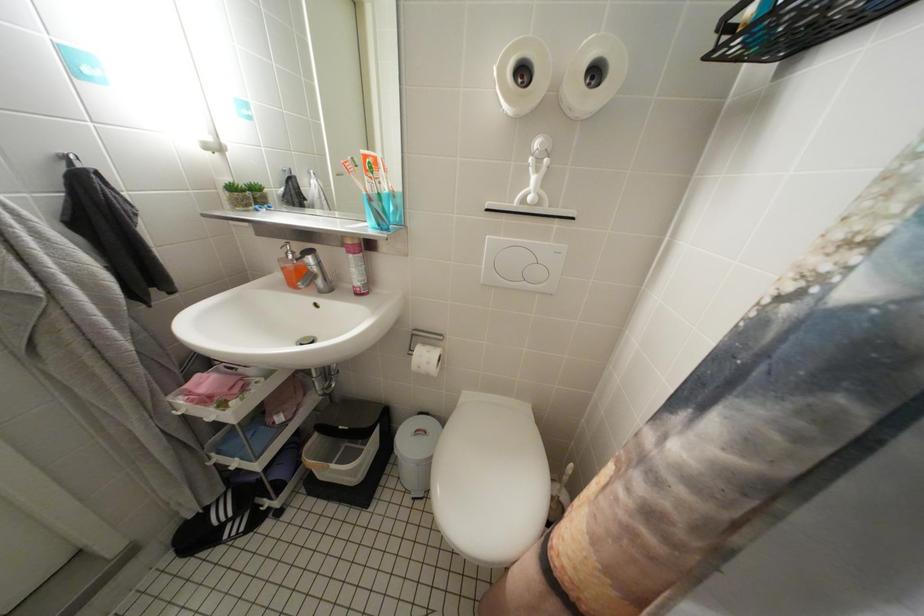
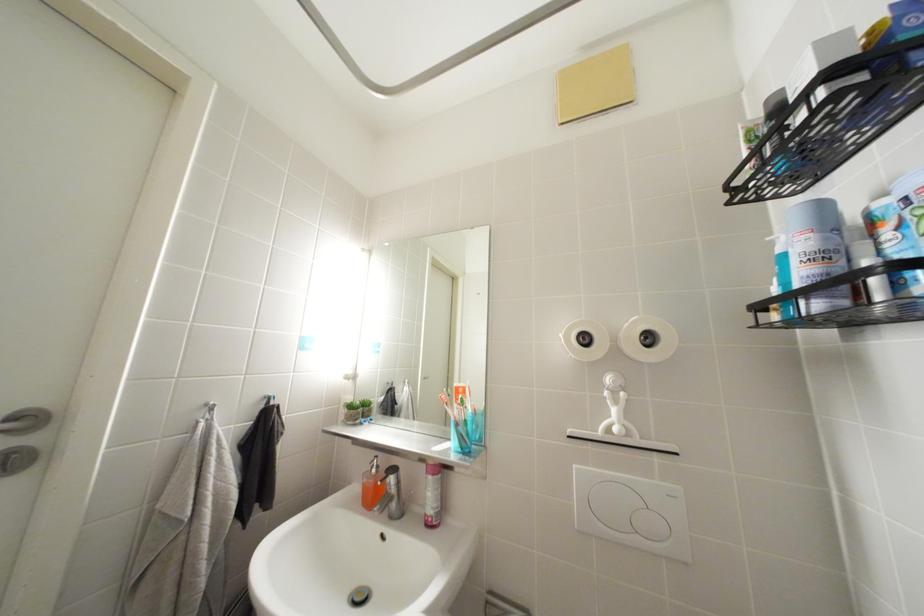
In the scene shown: The first image is from the beginning of the video and the second image is from the end. How did the camera likely rotate when shooting the video?

The camera's rotation is toward left-up.